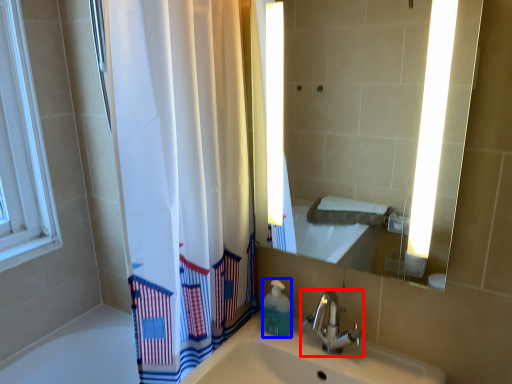
Question: Which of the following is the closest to the observer, tap (highlighted by a red box) or soap dispenser (highlighted by a blue box)?

Choices:
 (A) tap
 (B) soap dispenser

Answer: (A)